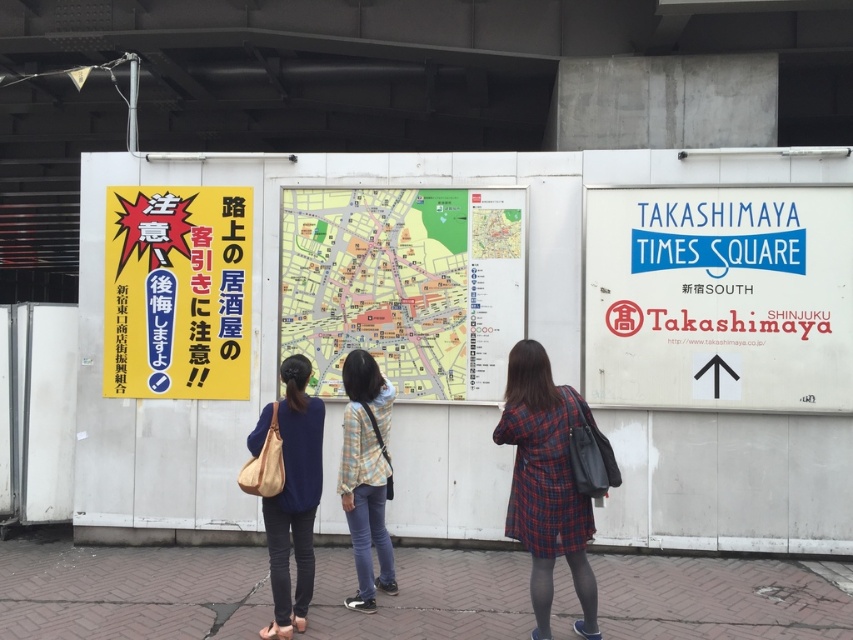
Question: Based on their relative distances, which object is farther from the light blue denim jeans at center?

Choices:
 (A) yellow paper map at center
 (B) white paper sign at right
 (C) brick pavement at lower center

Answer: (B)

Question: Which point appears farthest from the camera in this image?

Choices:
 (A) (277, 532)
 (B) (194, 365)

Answer: (B)

Question: Does brick pavement at lower center appear under plaid fabric dress at lower right?

Choices:
 (A) no
 (B) yes

Answer: (B)

Question: Can you confirm if brick pavement at lower center is bigger than plaid fabric dress at lower right?

Choices:
 (A) yes
 (B) no

Answer: (B)

Question: Where is yellow paper map at center located in relation to light blue denim jeans at center in the image?

Choices:
 (A) below
 (B) above

Answer: (B)

Question: Which point appears farthest from the camera in this image?

Choices:
 (A) (277, 541)
 (B) (509, 518)
 (C) (201, 189)

Answer: (C)